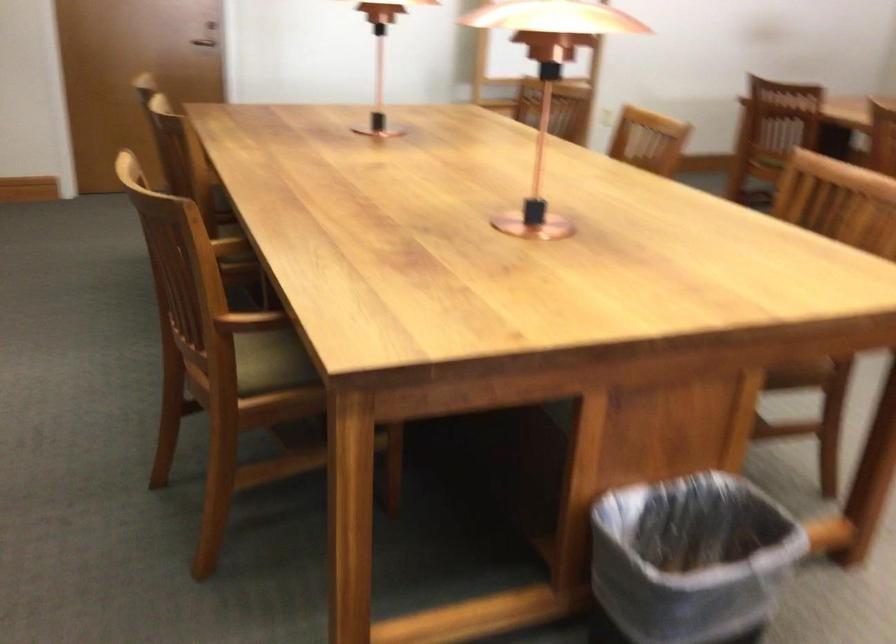
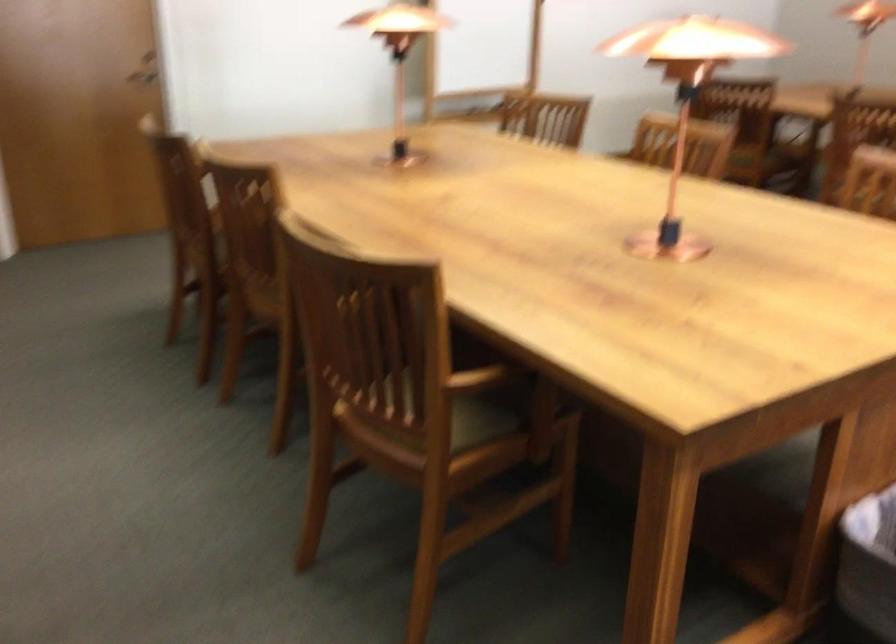
Question: The images are taken continuously from a first-person perspective. In which direction are you moving?

Choices:
 (A) Left
 (B) Right
 (C) Forward
 (D) Backward

Answer: (A)